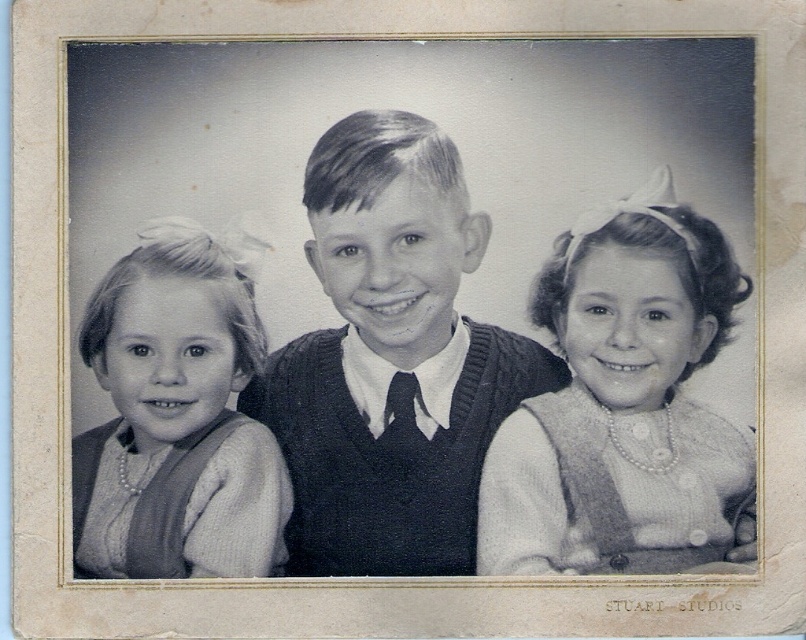
From the picture: Does pearl necklace at center have a lesser width compared to black silk tie at center?

In fact, pearl necklace at center might be wider than black silk tie at center.

Is pearl necklace at center further to the viewer compared to black silk tie at center?

No, pearl necklace at center is closer to the viewer.

You are a GUI agent. You are given a task and a screenshot of the screen. Output one action in this format:
    pyautogui.click(x=<x>, y=<y>)
    Task: Click on the pearl necklace at center
    
    Given the screenshot: What is the action you would take?
    pyautogui.click(x=624, y=404)

Identify the location of pearl necklace at center. (624, 404).

Does knitted sweater at center come in front of matte white sweater at left?

No, knitted sweater at center is further to the viewer.

Which is in front, point (426, 524) or point (134, 536)?

Point (134, 536) is in front.

Where is `knitted sweater at center`? knitted sweater at center is located at coordinates (389, 356).

Is matte white sweater at left above black silk tie at center?

Yes, matte white sweater at left is above black silk tie at center.

Is matte white sweater at left smaller than black silk tie at center?

No.

Measure the distance between matte white sweater at left and camera.

matte white sweater at left and camera are 6.65 feet apart.

This screenshot has height=640, width=806. In order to click on matte white sweater at left in this screenshot , I will do `click(177, 416)`.